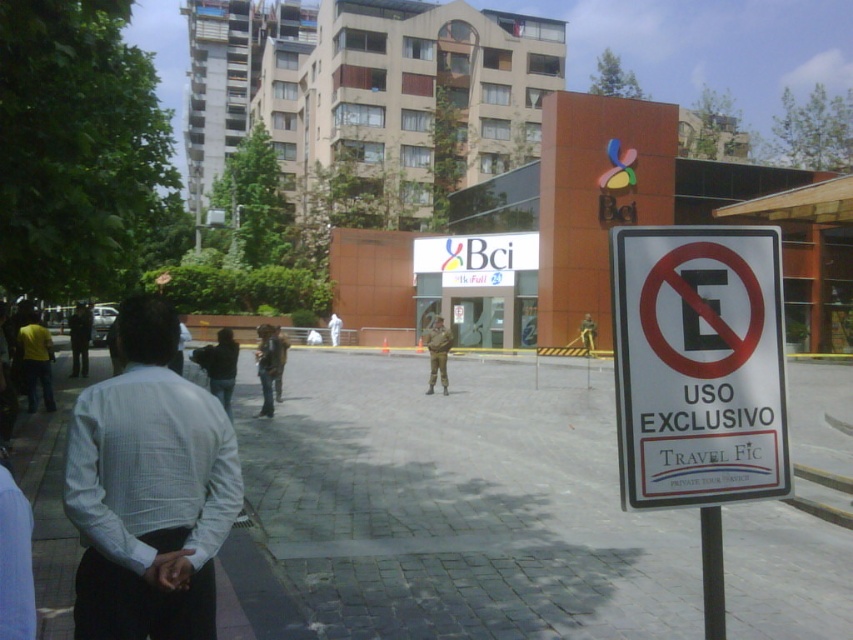
In the scene shown: You are a photographer trying to capture both the white checkered shirt at left and the camouflage uniform at center in the same frame. Based on their heights, which person should you position closer to the camera to ensure both are fully visible?

The white checkered shirt at left is shorter than the camouflage uniform at center. To ensure both are fully visible in the frame, position the white checkered shirt at left closer to the camera so that its shorter height balances with the camouflage uniform at center positioned further back.

You are a photographer trying to capture both the white checkered shirt at left and the dark blue uniform at center in a single frame. Which person should you focus on first to ensure they are in the frame before the other?

You should focus on the dark blue uniform at center first because it is wider than the white checkered shirt at left, making it easier to position within the frame.

You are a visitor trying to find the entrance to the restricted area marked by the sign. You see a white checkered shirt at left and a dark blue uniform at center. Which person should you approach for assistance?

The dark blue uniform at center is higher up than the white checkered shirt at left, so you should approach the dark blue uniform at center as they might be in a position of authority or more visible for assistance.